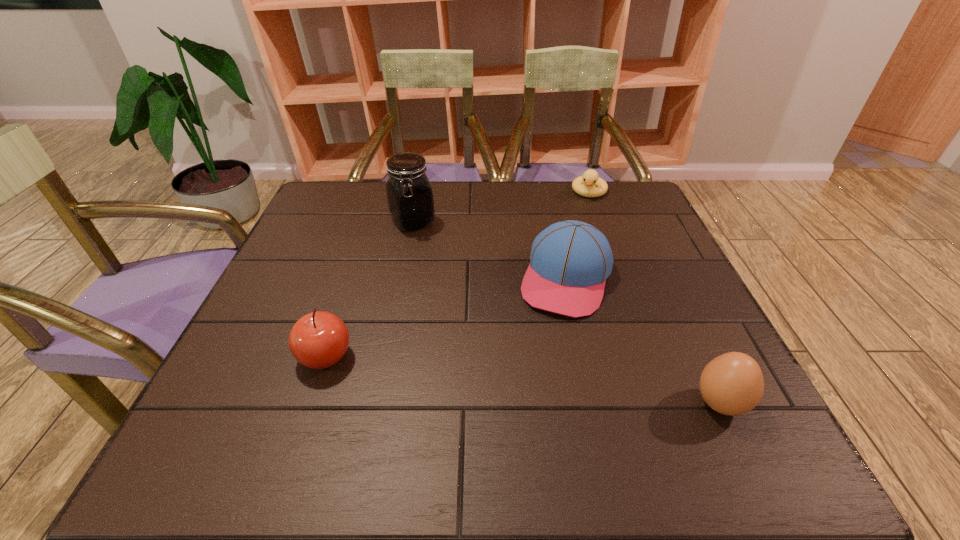
Find the location of `vacant space situated on the front-facing side of the third farthest object`. vacant space situated on the front-facing side of the third farthest object is located at coordinates (532, 394).

Locate an element on the screen. The image size is (960, 540). vacant space positioned 0.070m on the front-facing side of the third farthest object is located at coordinates (549, 342).

Where is `vacant space situated at the beak of the farthest object`? This screenshot has width=960, height=540. vacant space situated at the beak of the farthest object is located at coordinates (564, 267).

Locate an element on the screen. vacant space located at the beak of the farthest object is located at coordinates (581, 219).

The width and height of the screenshot is (960, 540). I want to click on vacant space located at the beak of the farthest object, so click(571, 248).

Where is `free space located on the lid of the fourth nearest object`? This screenshot has width=960, height=540. free space located on the lid of the fourth nearest object is located at coordinates (460, 277).

This screenshot has width=960, height=540. I want to click on free space located 0.260m on the lid of the fourth nearest object, so click(473, 292).

In order to click on blank area located 0.280m on the lid of the fourth nearest object in this screenshot , I will do `click(478, 298)`.

At what (x,y) coordinates should I click in order to perform the action: click on duckling located at the far edge. Please return your answer as a coordinate pair (x, y). Looking at the image, I should click on (x=584, y=185).

The width and height of the screenshot is (960, 540). I want to click on jar that is positioned at the far edge, so click(x=410, y=199).